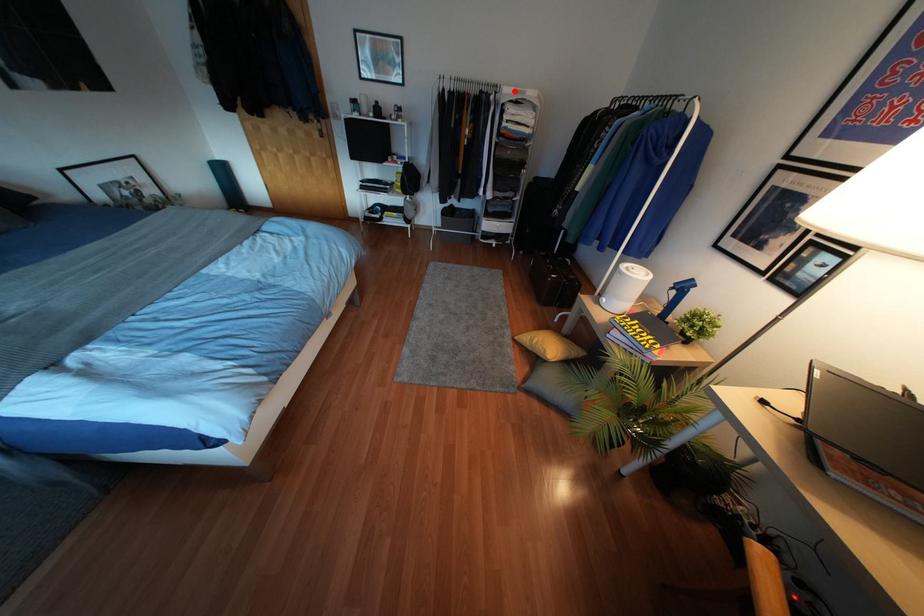
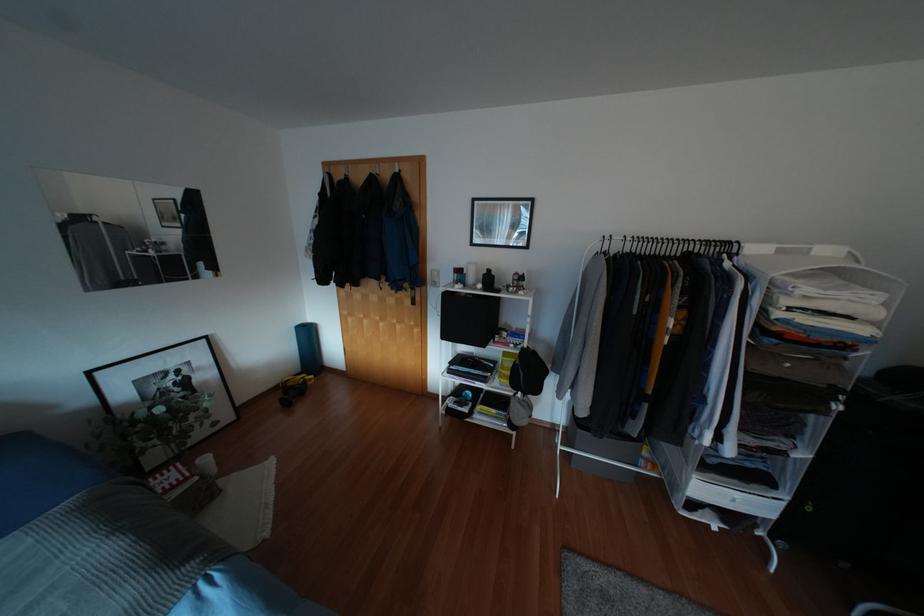
Find the pixel in the second image that matches the highlighted location in the first image.

(779, 251)